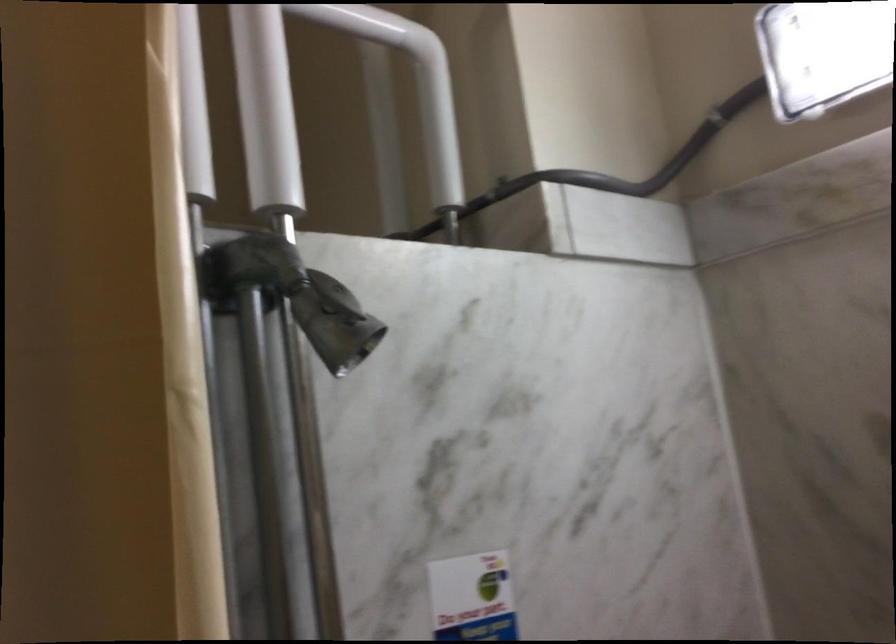
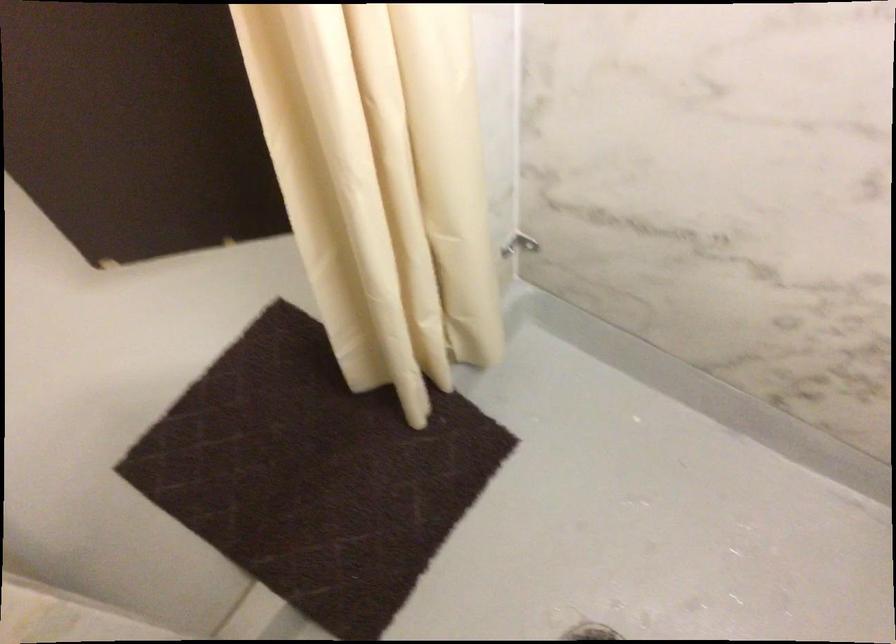
Question: The images are taken continuously from a first-person perspective. In which direction are you moving?

Choices:
 (A) Left
 (B) Right
 (C) Forward
 (D) Backward

Answer: (D)